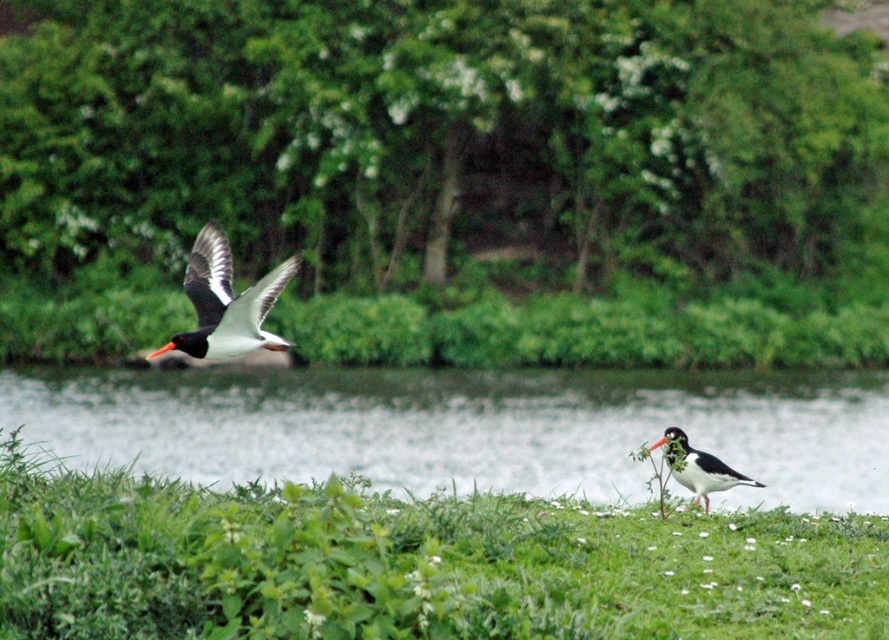
Is point (499, 582) farther from camera compared to point (677, 429)?

No, it is not.

Is green grassy at lower center shorter than speckled white bird at lower right?

In fact, green grassy at lower center may be taller than speckled white bird at lower right.

The width and height of the screenshot is (889, 640). What do you see at coordinates (412, 563) in the screenshot? I see `green grassy at lower center` at bounding box center [412, 563].

Where is `green grassy at lower center`? This screenshot has height=640, width=889. green grassy at lower center is located at coordinates (412, 563).

Who is positioned more to the left, black and white bird at upper left or speckled white bird at lower right?

black and white bird at upper left is more to the left.

Which is below, black and white bird at upper left or speckled white bird at lower right?

speckled white bird at lower right is lower down.

Where is `black and white bird at upper left`? The image size is (889, 640). black and white bird at upper left is located at coordinates (226, 301).

Is green grassy at lower center bigger than clear water at grass right?

Incorrect, green grassy at lower center is not larger than clear water at grass right.

Describe the element at coordinates (412, 563) in the screenshot. The image size is (889, 640). I see `green grassy at lower center` at that location.

Where is `green grassy at lower center`? The image size is (889, 640). green grassy at lower center is located at coordinates (412, 563).